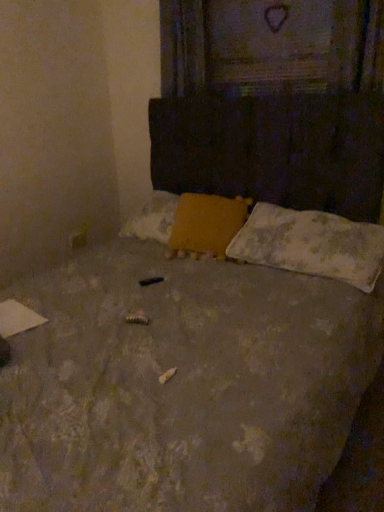
Question: Can you confirm if yellow fabric pillow at center, acting as the 1th pillow starting from the left, is wider than wooden textured frame at upper center?

Choices:
 (A) no
 (B) yes

Answer: (B)

Question: From the image's perspective, is yellow fabric pillow at center, which is counted as the second pillow, starting from the right, below wooden textured frame at upper center?

Choices:
 (A) yes
 (B) no

Answer: (A)

Question: Does yellow fabric pillow at center, which is counted as the second pillow, starting from the right, have a smaller size compared to wooden textured frame at upper center?

Choices:
 (A) no
 (B) yes

Answer: (A)

Question: Is yellow fabric pillow at center, which is counted as the second pillow, starting from the right, to the left of wooden textured frame at upper center from the viewer's perspective?

Choices:
 (A) no
 (B) yes

Answer: (B)

Question: From a real-world perspective, is yellow fabric pillow at center, which is counted as the second pillow, starting from the right, on wooden textured frame at upper center?

Choices:
 (A) yes
 (B) no

Answer: (B)

Question: Is point (264, 246) positioned closer to the camera than point (205, 253)?

Choices:
 (A) closer
 (B) farther

Answer: (A)

Question: From the image's perspective, relative to yellow fabric pillow at center, acting as the 1th pillow starting from the left, is white textured pillow at lower right, which ranks as the second pillow in left-to-right order, above or below?

Choices:
 (A) below
 (B) above

Answer: (A)

Question: Would you say white textured pillow at lower right, the first pillow in the right-to-left sequence, is to the left or to the right of yellow fabric pillow at center, acting as the 1th pillow starting from the left, in the picture?

Choices:
 (A) left
 (B) right

Answer: (B)

Question: In terms of size, does white textured pillow at lower right, which ranks as the second pillow in left-to-right order, appear bigger or smaller than yellow fabric pillow at center, which is counted as the second pillow, starting from the right?

Choices:
 (A) big
 (B) small

Answer: (A)

Question: From a real-world perspective, is wooden textured frame at upper center positioned above or below white textured pillow at lower right, which ranks as the second pillow in left-to-right order?

Choices:
 (A) above
 (B) below

Answer: (A)

Question: Which is correct: wooden textured frame at upper center is inside white textured pillow at lower right, the first pillow in the right-to-left sequence, or outside of it?

Choices:
 (A) inside
 (B) outside

Answer: (B)

Question: From the image's perspective, is wooden textured frame at upper center positioned above or below white textured pillow at lower right, which ranks as the second pillow in left-to-right order?

Choices:
 (A) above
 (B) below

Answer: (A)

Question: Would you say wooden textured frame at upper center is to the left or to the right of white textured pillow at lower right, which ranks as the second pillow in left-to-right order, in the picture?

Choices:
 (A) left
 (B) right

Answer: (A)

Question: Considering their positions, is wooden textured frame at upper center located in front of or behind yellow fabric pillow at center, acting as the 1th pillow starting from the left?

Choices:
 (A) front
 (B) behind

Answer: (B)

Question: In terms of height, does wooden textured frame at upper center look taller or shorter compared to yellow fabric pillow at center, which is counted as the second pillow, starting from the right?

Choices:
 (A) short
 (B) tall

Answer: (B)